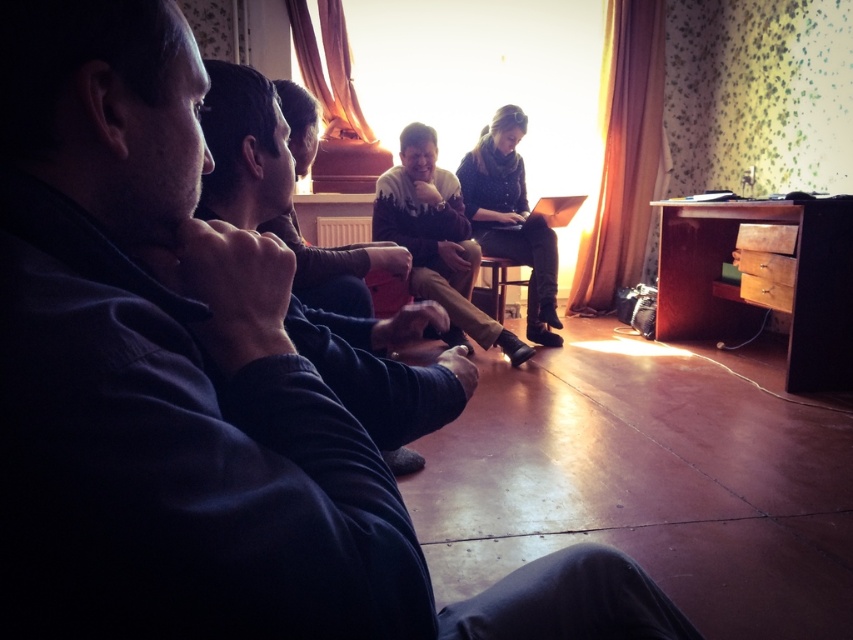
You are standing at the entrance of the room and want to greet the person wearing the dark blue sweater at center. Based on the coordinates provided, in which direction should you walk to reach them?

The dark blue sweater at center is located at coordinates point (244, 148), so you should walk towards the center of the room to reach them.

You are standing at the entrance of the room and want to see the person in the dark blue sweater at center. Which direction should you look relative to the wooden chair at center?

The dark blue sweater at center is below the wooden chair at center, so you should look downward from the wooden chair at center to see the person in the dark blue sweater at center.